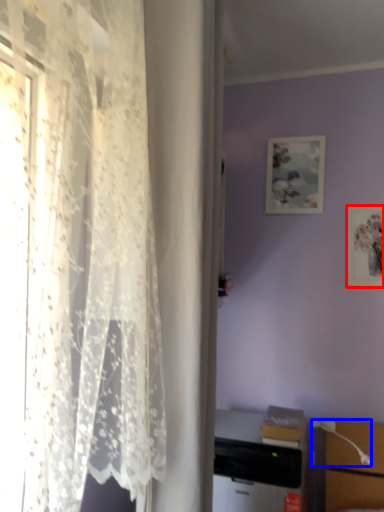
Question: Among these objects, which one is nearest to the camera, picture frame (highlighted by a red box) or table lamp (highlighted by a blue box)?

Choices:
 (A) picture frame
 (B) table lamp

Answer: (B)